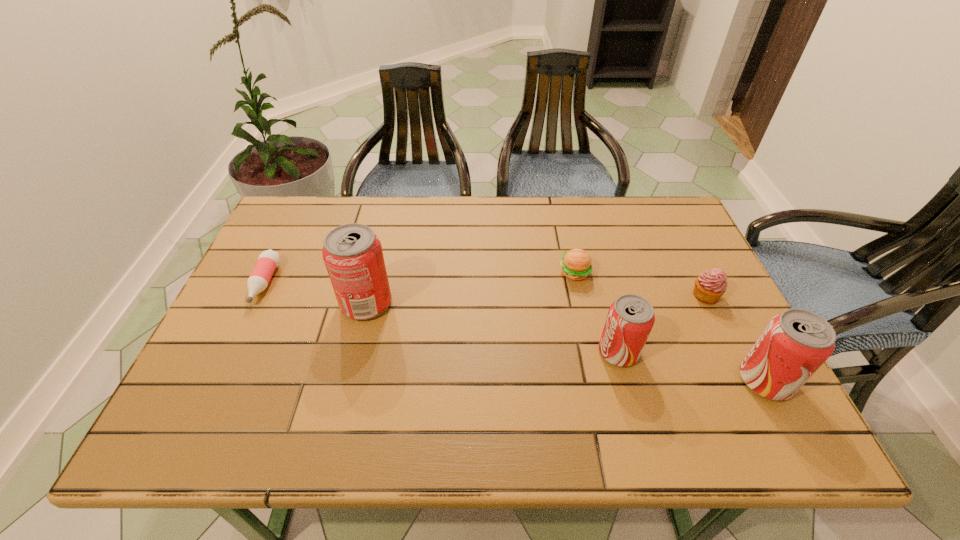
The image size is (960, 540). What are the coordinates of `the second closest soda can to the rightmost soda can` in the screenshot? It's located at (352, 253).

Where is `vacant area in the image that satisfies the following two spatial constraints: 1. on the front side of the farthest soda can; 2. on the right side of the second tallest object`? vacant area in the image that satisfies the following two spatial constraints: 1. on the front side of the farthest soda can; 2. on the right side of the second tallest object is located at coordinates (348, 380).

The width and height of the screenshot is (960, 540). What are the coordinates of `free space that satisfies the following two spatial constraints: 1. on the front side of the rightmost soda can; 2. on the left side of the hamburger` in the screenshot? It's located at (598, 380).

At what (x,y) coordinates should I click in order to perform the action: click on vacant position in the image that satisfies the following two spatial constraints: 1. with the cap open on the leftmost object; 2. on the left side of the second shortest soda can. Please return your answer as a coordinate pair (x, y). Looking at the image, I should click on (218, 380).